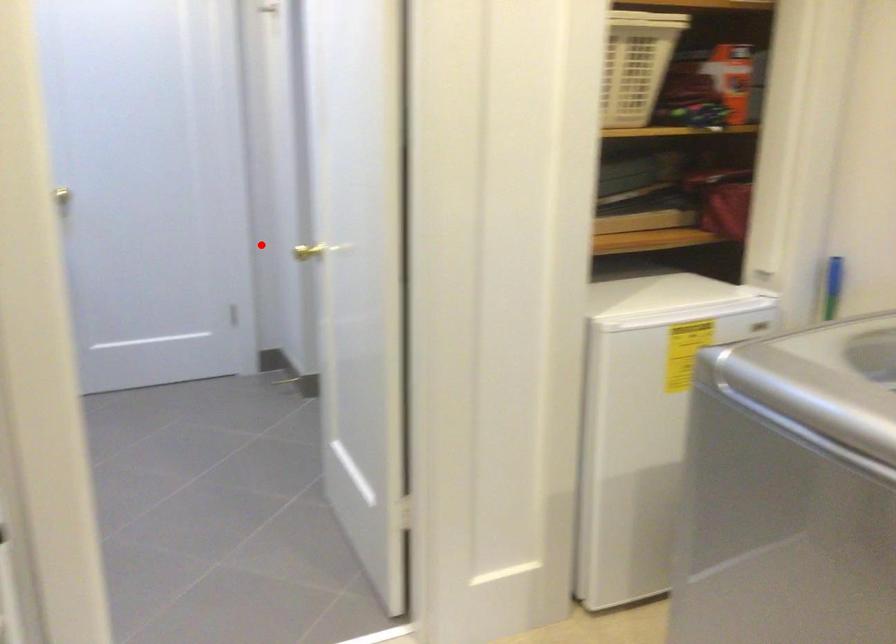
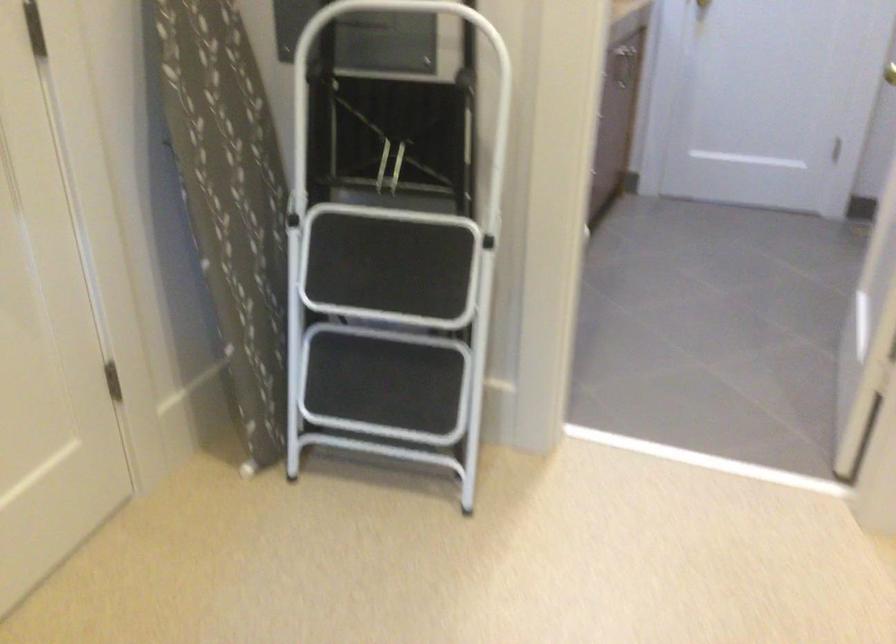
Where in the second image is the point corresponding to the highlighted location from the first image?

(890, 73)